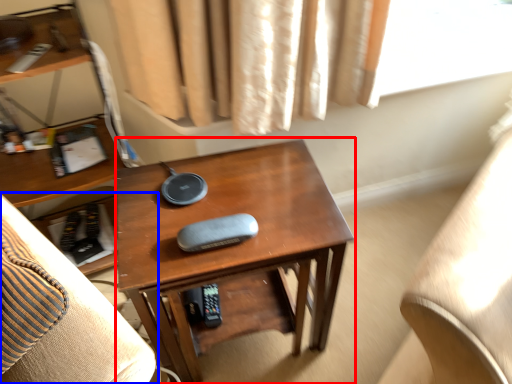
Question: Which point is further to the camera, desk (highlighted by a red box) or furniture (highlighted by a blue box)?

Choices:
 (A) desk
 (B) furniture

Answer: (A)